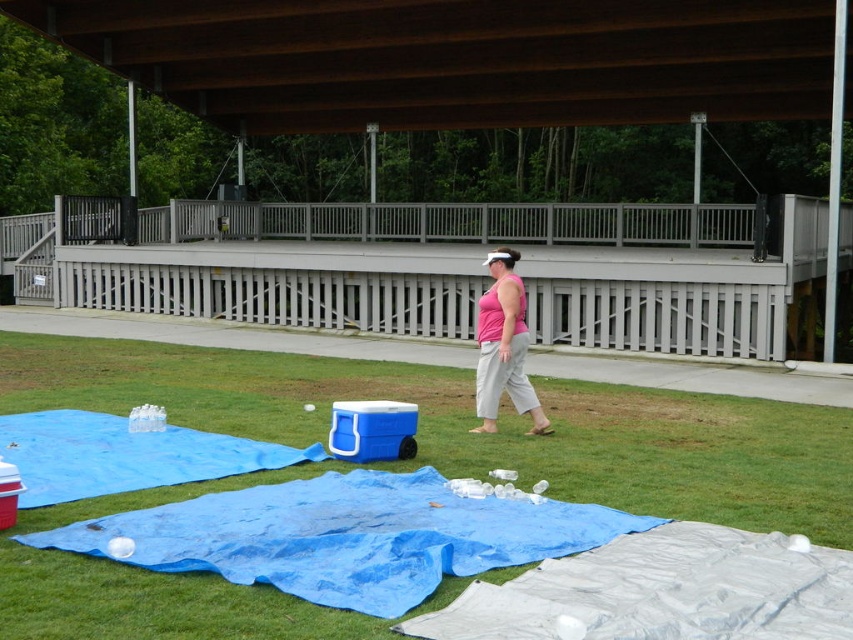
You are a photographer standing at the bottom of the wooden steps leading up to the pavilion. You want to take a photo of the blue tarp at lower center and the pink matte tank top at center. Which object should you focus on first if you want to capture both in the frame?

The blue tarp at lower center is located below the pink matte tank top at center, so you should focus on the pink matte tank top at center first to ensure it stays in the frame while adjusting for the lower positioned blue tarp at lower center.

You are standing at the top of the wooden pavilion steps. You see the green grass at center and the blue tarp at lower center. Which one is closer to you?

The green grass at center is closer to you because it is in front of the blue tarp at lower center.